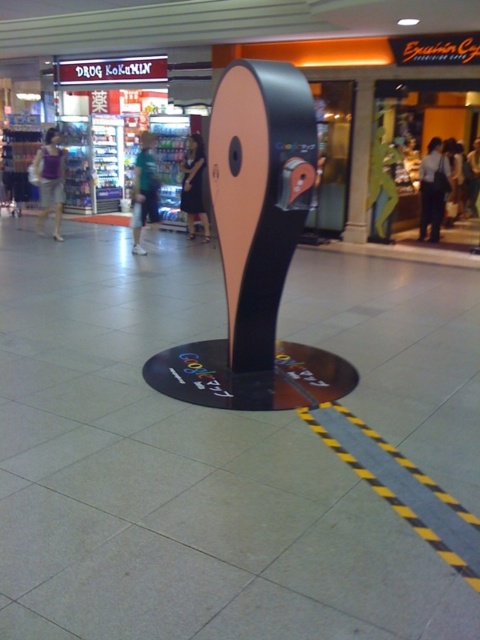
You are a customer standing in the shopping mall and see both the orange matte sign at center and the green fabric bag at center. Which object is taller?

The orange matte sign at center is taller than the green fabric bag at center.

Based on the photo, you are a customer in the mall and want to see both the matte black display stand at center and the orange matte sign at center. Which one do you need to look up more to see?

The matte black display stand at center is much taller than the orange matte sign at center, so you need to look up more to see the matte black display stand at center.